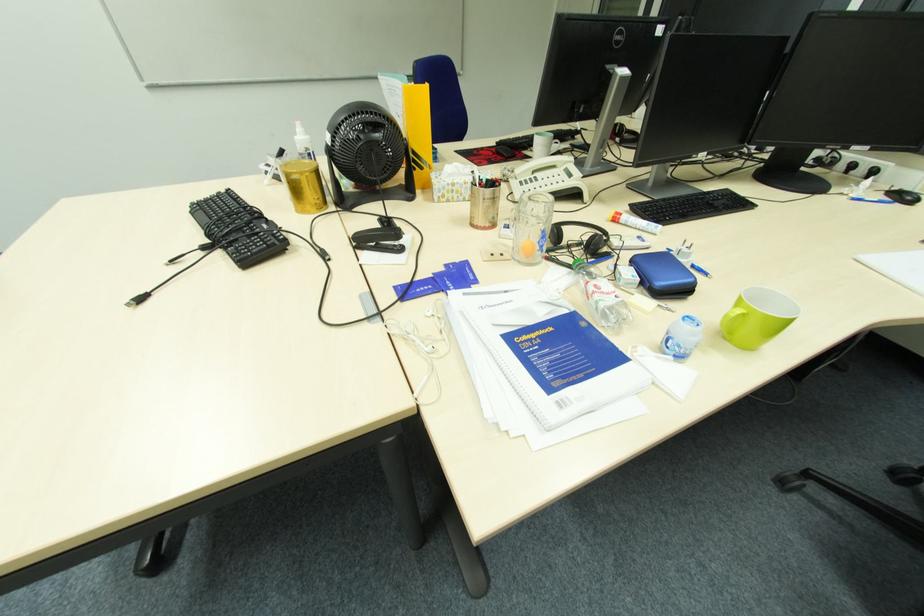
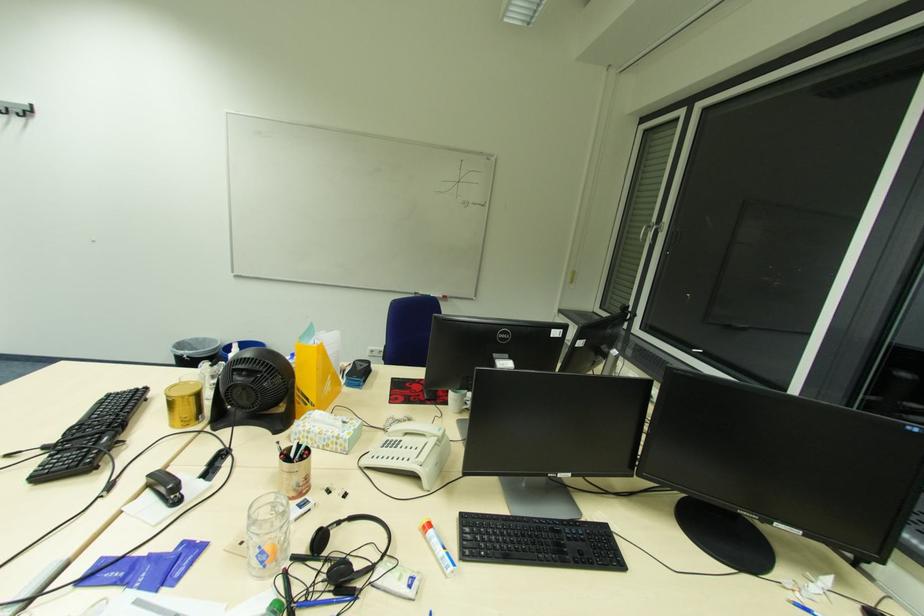
The images are taken continuously from a first-person perspective. In which direction is your viewpoint rotating?

The camera's rotation is toward left-up.